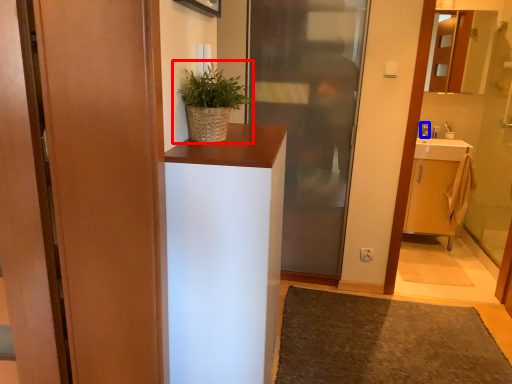
Question: Which point is further to the camera, houseplant (highlighted by a red box) or toiletry (highlighted by a blue box)?

Choices:
 (A) houseplant
 (B) toiletry

Answer: (B)